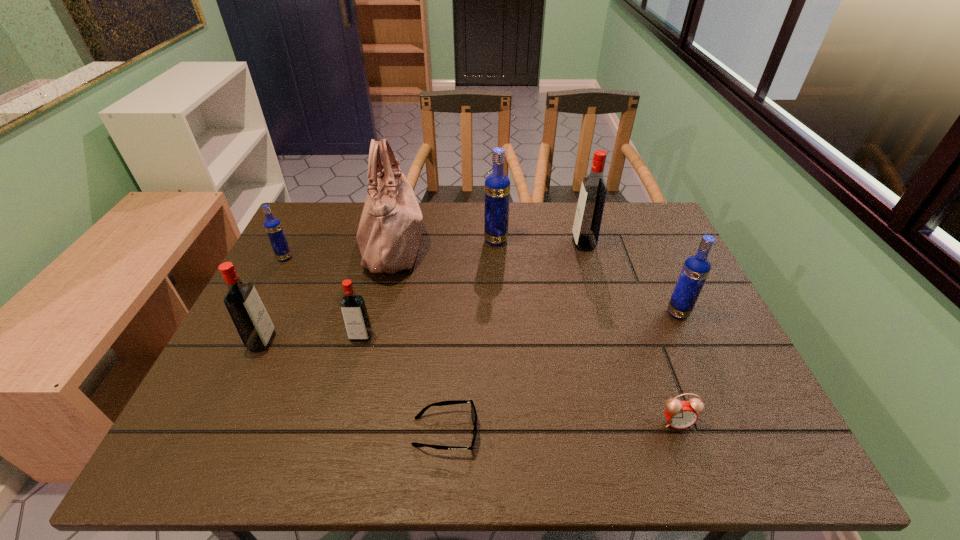
Identify the location of vacant point located between the sunglasses and the second red vodka from left to right. (403, 384).

I want to click on vacant area that lies between the second biggest blue vodka and the second object from left to right, so click(x=470, y=327).

This screenshot has width=960, height=540. I want to click on free point between the second red vodka from left to right and the rightmost red vodka, so click(472, 290).

Locate an element on the screen. Image resolution: width=960 pixels, height=540 pixels. vacant area between the second object from left to right and the second shortest object is located at coordinates (469, 382).

You are a GUI agent. You are given a task and a screenshot of the screen. Output one action in this format:
    pyautogui.click(x=<x>, y=<y>)
    Task: Click on the vacant area that lies between the smallest red vodka and the second vodka from left to right
    
    Given the screenshot: What is the action you would take?
    pyautogui.click(x=312, y=339)

The height and width of the screenshot is (540, 960). I want to click on vacant point located between the eighth object from right to left and the rightmost vodka, so click(470, 327).

Image resolution: width=960 pixels, height=540 pixels. I want to click on object that is the eighth nearest to the second red vodka from right to left, so click(x=696, y=268).

Identify which object is located as the sixth nearest to the rightmost red vodka. Please provide its 2D coordinates. Your answer should be formatted as a tuple, i.e. [(x, y)], where the tuple contains the x and y coordinates of a point satisfying the conditions above.

[(353, 308)]

The height and width of the screenshot is (540, 960). I want to click on vodka that is the third closest to the leftmost red vodka, so click(x=497, y=185).

This screenshot has height=540, width=960. I want to click on the second closest vodka to the fourth vodka from right to left, so click(273, 227).